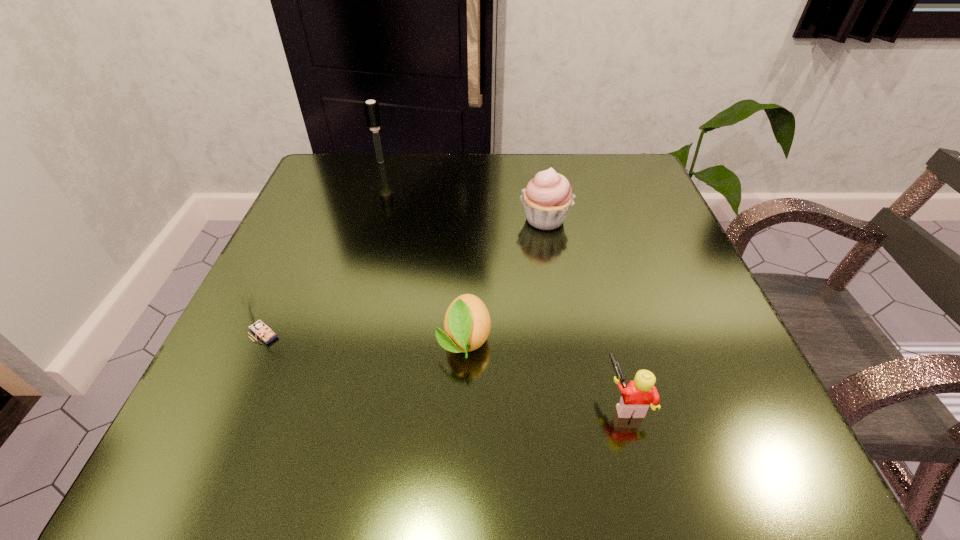
This screenshot has height=540, width=960. I want to click on vacant area that lies between the second object from left to right and the second tallest object, so click(x=463, y=191).

This screenshot has height=540, width=960. In order to click on vacant area that lies between the matchbox and the fourth object from right to left in this screenshot , I will do click(x=323, y=247).

Find the location of `vacant area that lies between the third object from left to right and the hairbrush`. vacant area that lies between the third object from left to right and the hairbrush is located at coordinates (422, 251).

This screenshot has height=540, width=960. Identify the location of vacant space in between the matchbox and the fourth nearest object. (404, 276).

Identify the location of free space that is in between the farthest object and the leftmost object. (323, 247).

Find the location of a particular element. The height and width of the screenshot is (540, 960). empty location between the third object from left to right and the Lego is located at coordinates (545, 370).

What are the coordinates of `empty space between the Lego and the lemon` in the screenshot? It's located at (545, 370).

Identify the location of vacant space that's between the third object from left to right and the fourth nearest object. The width and height of the screenshot is (960, 540). (505, 280).

Locate which object is the third closest to the lemon. Please provide its 2D coordinates. Your answer should be formatted as a tuple, i.e. [(x, y)], where the tuple contains the x and y coordinates of a point satisfying the conditions above.

[(260, 329)]

Identify which object is the closest to the leftmost object. Please provide its 2D coordinates. Your answer should be formatted as a tuple, i.e. [(x, y)], where the tuple contains the x and y coordinates of a point satisfying the conditions above.

[(467, 323)]